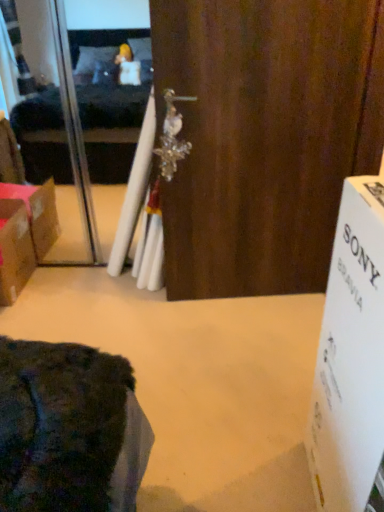
Question: Considering the relative sizes of white cardboard box at right and brown cardboard box at left in the image provided, is white cardboard box at right shorter than brown cardboard box at left?

Choices:
 (A) yes
 (B) no

Answer: (B)

Question: Is white cardboard box at right looking in the opposite direction of brown cardboard box at left?

Choices:
 (A) yes
 (B) no

Answer: (B)

Question: From the image's perspective, is white cardboard box at right over brown cardboard box at left?

Choices:
 (A) yes
 (B) no

Answer: (B)

Question: Considering the relative sizes of white cardboard box at right and brown cardboard box at left in the image provided, is white cardboard box at right taller than brown cardboard box at left?

Choices:
 (A) no
 (B) yes

Answer: (B)

Question: Can you confirm if white cardboard box at right is wider than brown cardboard box at left?

Choices:
 (A) yes
 (B) no

Answer: (B)

Question: Is transparent plastic screen door at upper left situated inside wooden door at center or outside?

Choices:
 (A) inside
 (B) outside

Answer: (B)

Question: From the image's perspective, is transparent plastic screen door at upper left above or below wooden door at center?

Choices:
 (A) above
 (B) below

Answer: (A)

Question: Considering the positions of transparent plastic screen door at upper left and wooden door at center in the image, is transparent plastic screen door at upper left taller or shorter than wooden door at center?

Choices:
 (A) tall
 (B) short

Answer: (A)

Question: Is transparent plastic screen door at upper left wider or thinner than wooden door at center?

Choices:
 (A) thin
 (B) wide

Answer: (B)

Question: Relative to brown cardboard box at left, is transparent plastic screen door at upper left in front or behind?

Choices:
 (A) front
 (B) behind

Answer: (B)

Question: Is point (91, 242) positioned closer to the camera than point (18, 231)?

Choices:
 (A) closer
 (B) farther

Answer: (B)

Question: From their relative heights in the image, would you say transparent plastic screen door at upper left is taller or shorter than brown cardboard box at left?

Choices:
 (A) tall
 (B) short

Answer: (A)

Question: Considering the positions of transparent plastic screen door at upper left and brown cardboard box at left in the image, is transparent plastic screen door at upper left bigger or smaller than brown cardboard box at left?

Choices:
 (A) big
 (B) small

Answer: (A)

Question: In terms of height, does white cardboard box at right look taller or shorter compared to transparent plastic screen door at upper left?

Choices:
 (A) tall
 (B) short

Answer: (B)

Question: Considering the positions of white cardboard box at right and transparent plastic screen door at upper left in the image, is white cardboard box at right wider or thinner than transparent plastic screen door at upper left?

Choices:
 (A) thin
 (B) wide

Answer: (B)